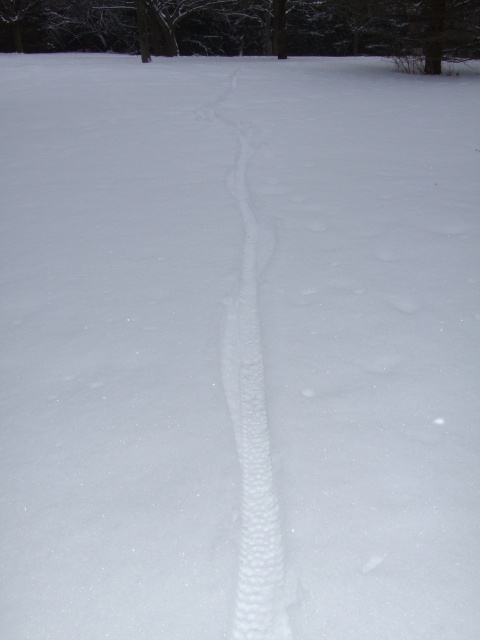
Which is behind, point (171, 33) or point (249, 588)?

Positioned behind is point (171, 33).

You are a GUI agent. You are given a task and a screenshot of the screen. Output one action in this format:
    pyautogui.click(x=<x>, y=<y>)
    Task: Click on the brown textured tree at upper center
    The image size is (480, 640).
    Given the screenshot: What is the action you would take?
    pyautogui.click(x=247, y=26)

Find the location of a particular element. brown textured tree at upper center is located at coordinates (247, 26).